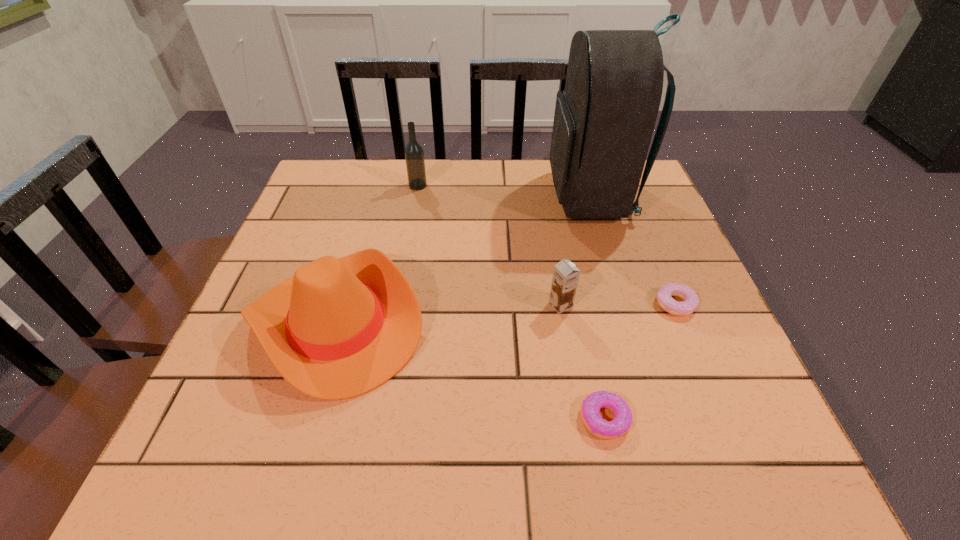
Find the location of a particular element. free space located on the back of the cowboy hat is located at coordinates (367, 221).

Locate an element on the screen. blank space located 0.060m on the left of the fourth tallest object is located at coordinates (519, 305).

Where is `vacant region located on the left of the right doughnut`? The height and width of the screenshot is (540, 960). vacant region located on the left of the right doughnut is located at coordinates (552, 304).

The height and width of the screenshot is (540, 960). I want to click on vacant space located 0.210m on the left of the nearer doughnut, so tap(452, 418).

You are a GUI agent. You are given a task and a screenshot of the screen. Output one action in this format:
    pyautogui.click(x=<x>, y=<y>)
    Task: Click on the backpack at the far edge
    The height and width of the screenshot is (540, 960).
    Given the screenshot: What is the action you would take?
    pyautogui.click(x=604, y=119)

In order to click on vodka present at the far edge in this screenshot , I will do (414, 155).

Where is `object at the near edge`? This screenshot has width=960, height=540. object at the near edge is located at coordinates (590, 408).

This screenshot has height=540, width=960. In order to click on object located at the left edge in this screenshot , I will do `click(340, 327)`.

Find the location of `backpack present at the right edge`. backpack present at the right edge is located at coordinates (604, 119).

Find the location of a particular element. doughnut located at the right edge is located at coordinates (690, 304).